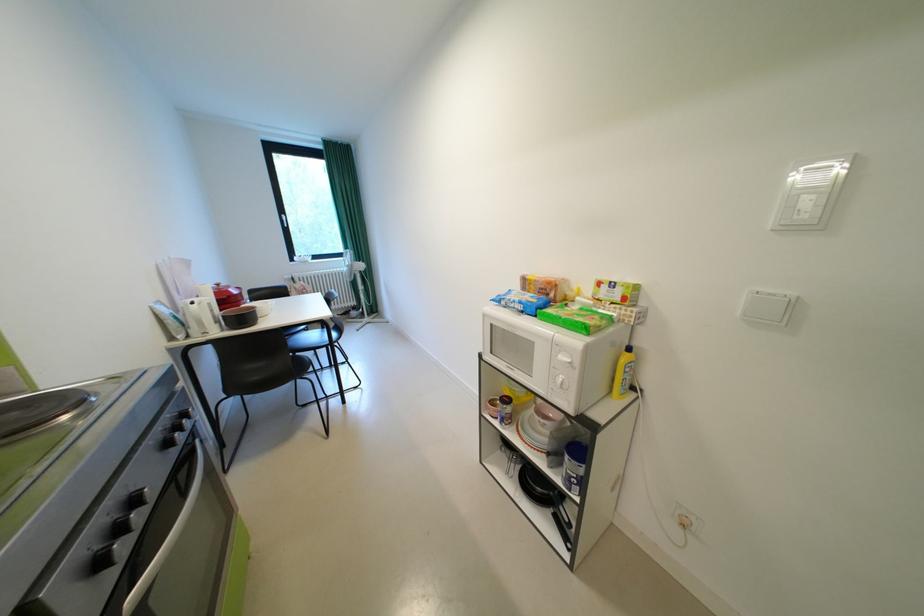
Where would you pull the silver oven handle? Please return your answer as a coordinate pair (x, y).

(167, 536)